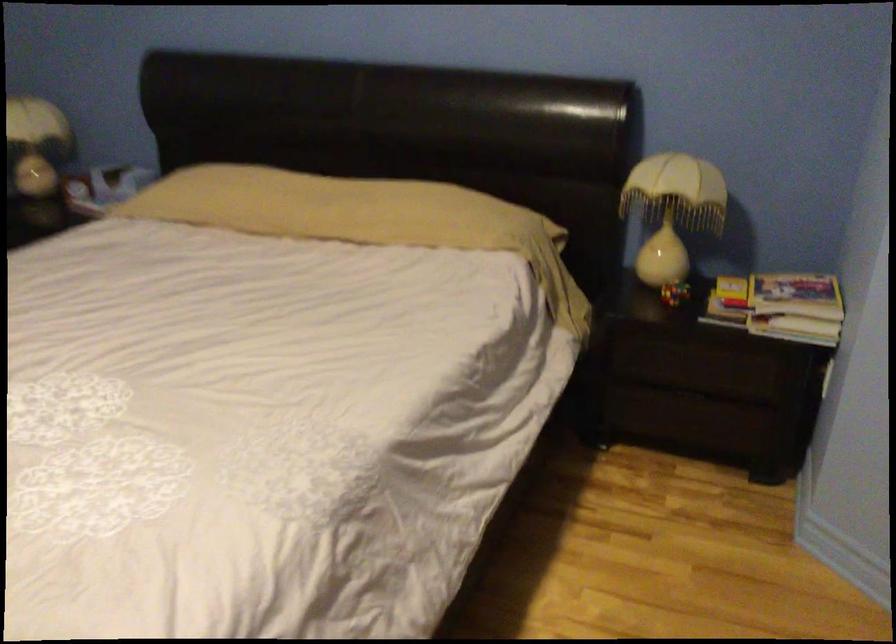
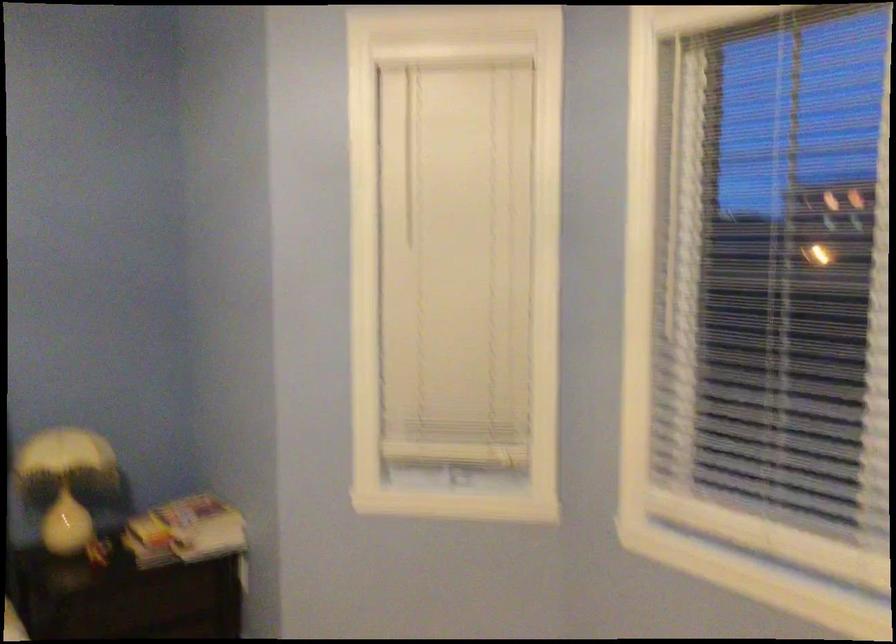
Question: The images are taken continuously from a first-person perspective. In which direction is your viewpoint rotating?

Choices:
 (A) Left
 (B) Right
 (C) Up
 (D) Down

Answer: (B)